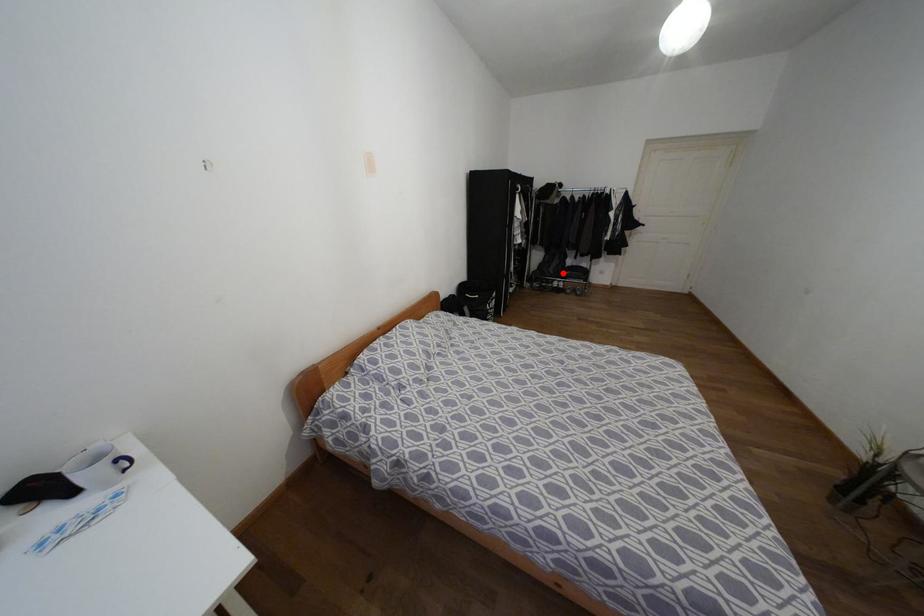
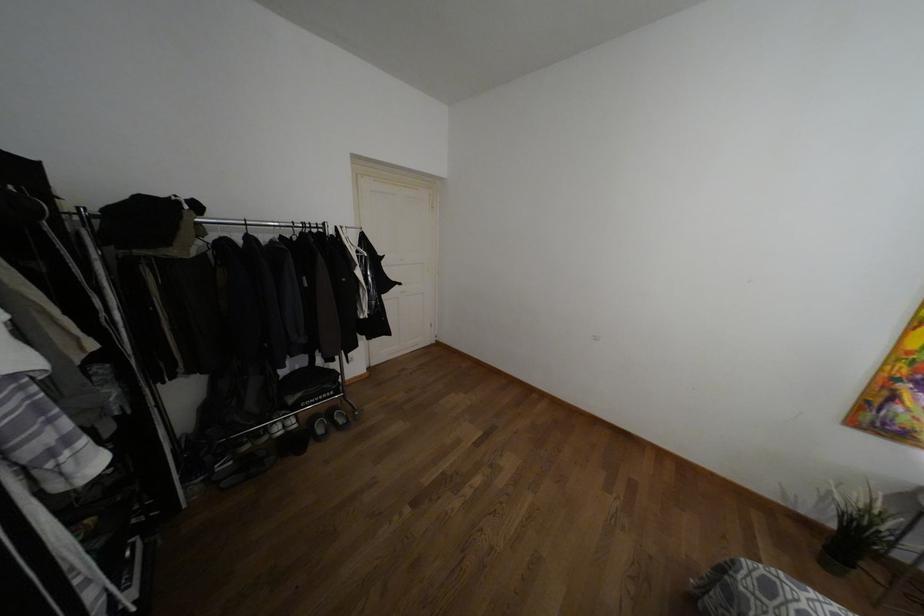
Where in the second image is the point corresponding to the highlighted location from the first image?

(290, 399)